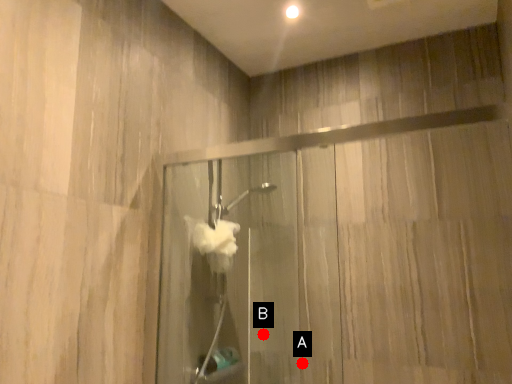
Question: Two points are circled on the image, labeled by A and B beside each circle. Which point is closer to the camera taking this photo?

Choices:
 (A) A is closer
 (B) B is closer

Answer: (A)